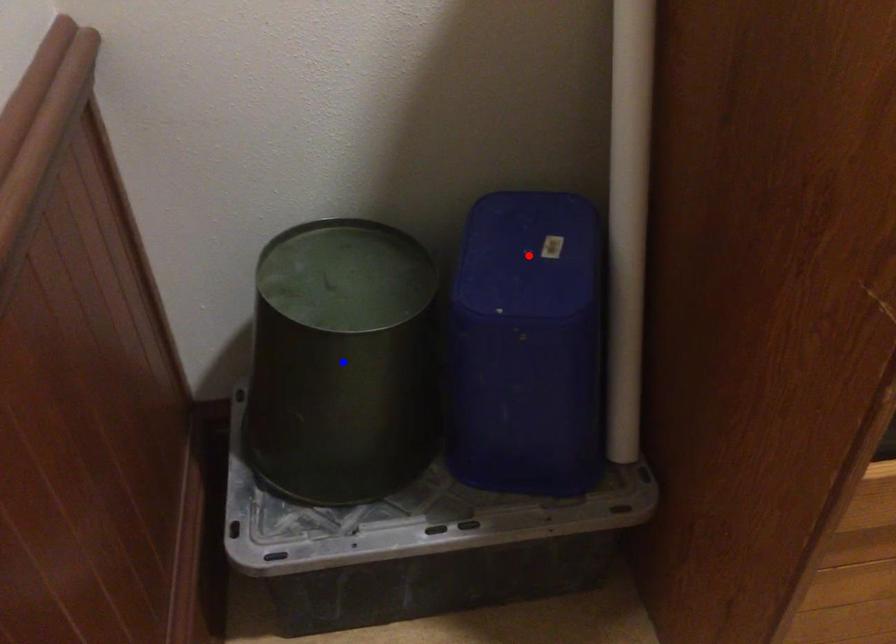
Question: Two points are marked on the image. Which point is closer to the camera?

Choices:
 (A) Blue point is closer.
 (B) Red point is closer.

Answer: (A)